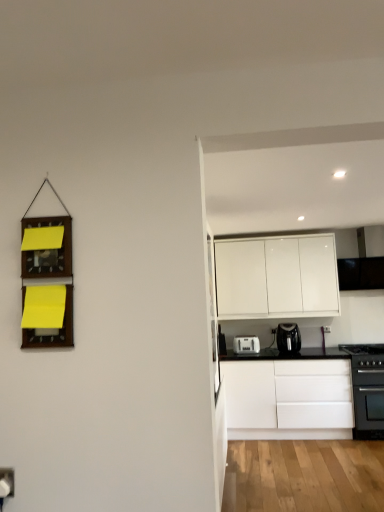
Question: In which direction should I rotate to look at black plastic coffee maker at center, positioned as the 1th kitchen appliance in right-to-left order?

Choices:
 (A) right
 (B) left

Answer: (A)

Question: Is black matte gas stove at right next to black plastic coffee maker at center, the second kitchen appliance in the left-to-right sequence?

Choices:
 (A) no
 (B) yes

Answer: (A)

Question: Is black matte gas stove at right positioned behind black plastic coffee maker at center, positioned as the 1th kitchen appliance in right-to-left order?

Choices:
 (A) no
 (B) yes

Answer: (A)

Question: Considering the relative sizes of black matte gas stove at right and black plastic coffee maker at center, positioned as the 1th kitchen appliance in right-to-left order, in the image provided, is black matte gas stove at right bigger than black plastic coffee maker at center, positioned as the 1th kitchen appliance in right-to-left order,?

Choices:
 (A) yes
 (B) no

Answer: (A)

Question: Can you confirm if black matte gas stove at right is thinner than black plastic coffee maker at center, positioned as the 1th kitchen appliance in right-to-left order?

Choices:
 (A) no
 (B) yes

Answer: (A)

Question: Is black matte gas stove at right completely or partially outside of black plastic coffee maker at center, the second kitchen appliance in the left-to-right sequence?

Choices:
 (A) yes
 (B) no

Answer: (A)

Question: Is black matte gas stove at right to the left of black plastic coffee maker at center, the second kitchen appliance in the left-to-right sequence, from the viewer's perspective?

Choices:
 (A) yes
 (B) no

Answer: (B)

Question: From a real-world perspective, is white plastic electric outlet at lower left positioned over white glossy cabinet at upper right, the 1th cabinetry from the top, based on gravity?

Choices:
 (A) yes
 (B) no

Answer: (B)

Question: Can you confirm if white plastic electric outlet at lower left is taller than white glossy cabinet at upper right, the 1th cabinetry from the top?

Choices:
 (A) yes
 (B) no

Answer: (B)

Question: From the image's perspective, would you say white plastic electric outlet at lower left is shown under white glossy cabinet at upper right, the 1th cabinetry from the top?

Choices:
 (A) no
 (B) yes

Answer: (B)

Question: Does white plastic electric outlet at lower left have a larger size compared to white glossy cabinet at upper right, which appears as the 2th cabinetry when ordered from the bottom?

Choices:
 (A) no
 (B) yes

Answer: (A)

Question: From a real-world perspective, is white plastic electric outlet at lower left physically below white glossy cabinet at upper right, which appears as the 2th cabinetry when ordered from the bottom?

Choices:
 (A) no
 (B) yes

Answer: (B)

Question: Does white plastic electric outlet at lower left appear on the right side of white glossy cabinet at upper right, the 1th cabinetry from the top?

Choices:
 (A) no
 (B) yes

Answer: (A)

Question: Can you confirm if black matte gas stove at right is positioned to the right of white plastic toaster at lower center, the 2th kitchen appliance in the right-to-left sequence?

Choices:
 (A) no
 (B) yes

Answer: (B)